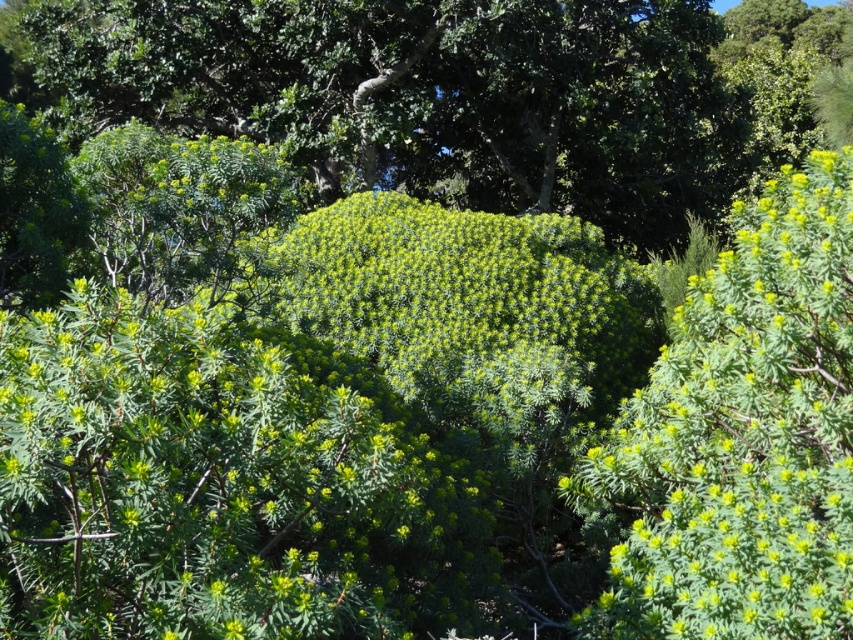
Is green leafy bush at center closer to the viewer compared to green fuzzy bush at upper right?

No, it is not.

Can you confirm if green leafy bush at center is positioned to the left of green fuzzy bush at upper right?

Yes, green leafy bush at center is to the left of green fuzzy bush at upper right.

Where is `green leafy bush at center`? green leafy bush at center is located at coordinates (426, 96).